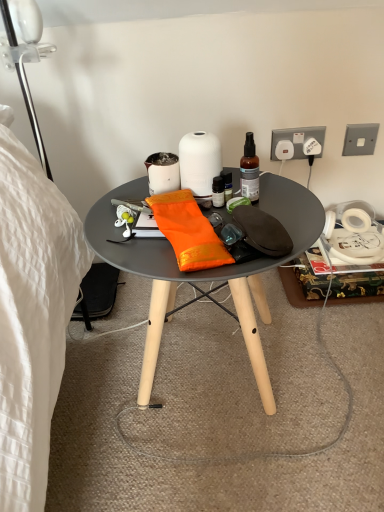
Question: From the image's perspective, is translucent glass spray bottle at upper right located above or below matte black table at center?

Choices:
 (A) above
 (B) below

Answer: (A)

Question: Is translucent glass spray bottle at upper right taller or shorter than matte black table at center?

Choices:
 (A) tall
 (B) short

Answer: (B)

Question: Based on their relative distances, which object is farther from the matte black table at center?

Choices:
 (A) matte white coffee cup at center
 (B) white plastic power outlet at upper right, which ranks as the 3th power outlet in right-to-left order
 (C) translucent glass spray bottle at upper right
 (D) orange silk cloth at center
 (E) white plastic power outlet at upper right, which appears as the 2th power outlet when viewed from the right

Answer: (E)

Question: Estimate the real-world distances between objects in this image. Which object is closer to the orange silk cloth at center?

Choices:
 (A) white plastic power outlet at upper right, which appears as the 1th power outlet when viewed from the left
 (B) transparent plastic lamp at upper left
 (C) translucent glass spray bottle at upper right
 (D) matte white coffee cup at center
 (E) metallic silver power outlet at upper right, acting as the first power outlet starting from the right

Answer: (D)